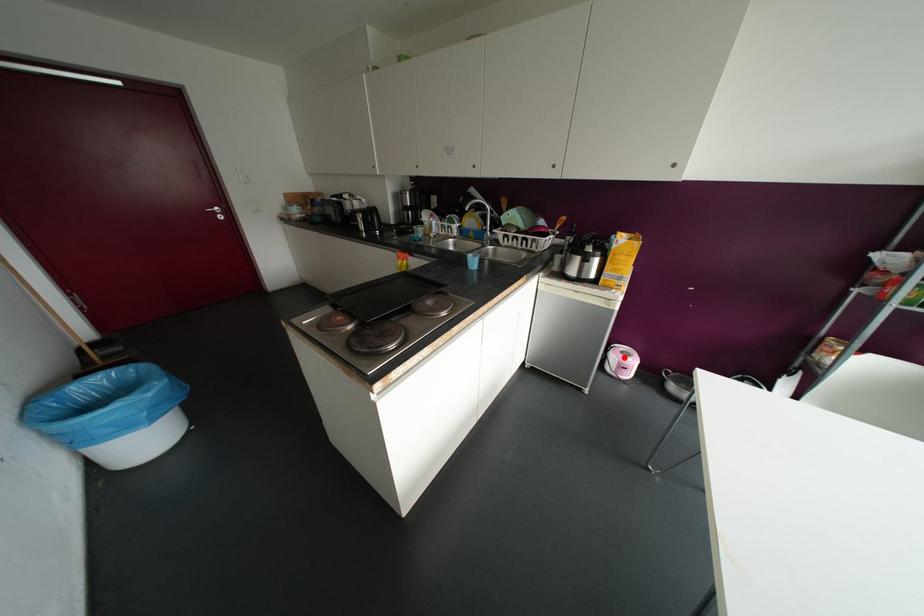
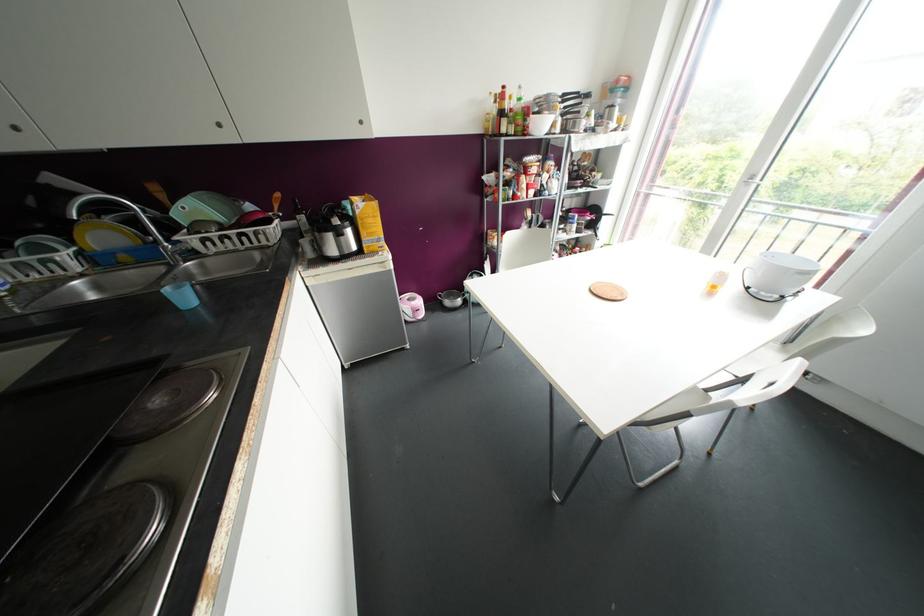
Where in the second image is the point corresponding to the highlighted location from the first image?

(412, 302)